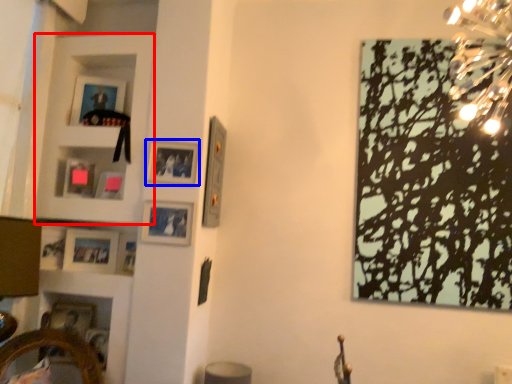
Question: Among these objects, which one is nearest to the camera, cabinet (highlighted by a red box) or picture frame (highlighted by a blue box)?

Choices:
 (A) cabinet
 (B) picture frame

Answer: (B)